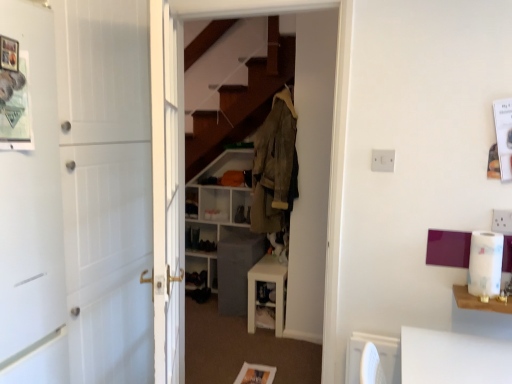
Question: Is the surface of white glossy cabinet at center in direct contact with dark gray fabric shoe at center?

Choices:
 (A) yes
 (B) no

Answer: (B)

Question: Does white glossy cabinet at center have a larger size compared to dark gray fabric shoe at center?

Choices:
 (A) no
 (B) yes

Answer: (B)

Question: Does white glossy cabinet at center have a smaller size compared to dark gray fabric shoe at center?

Choices:
 (A) yes
 (B) no

Answer: (B)

Question: Can you confirm if white glossy cabinet at center is wider than dark gray fabric shoe at center?

Choices:
 (A) no
 (B) yes

Answer: (B)

Question: Does white glossy cabinet at center have a greater height compared to dark gray fabric shoe at center?

Choices:
 (A) no
 (B) yes

Answer: (B)

Question: Is white glossy cabinet at center positioned behind dark gray fabric shoe at center?

Choices:
 (A) no
 (B) yes

Answer: (A)

Question: Can you confirm if white plastic table at right is smaller than camouflage fabric jacket at center?

Choices:
 (A) yes
 (B) no

Answer: (A)

Question: From a real-world perspective, is white plastic table at right over camouflage fabric jacket at center?

Choices:
 (A) yes
 (B) no

Answer: (B)

Question: Is white plastic table at right at the left side of camouflage fabric jacket at center?

Choices:
 (A) yes
 (B) no

Answer: (B)

Question: From the image's perspective, is white plastic table at right on top of camouflage fabric jacket at center?

Choices:
 (A) no
 (B) yes

Answer: (A)

Question: Considering the relative positions of white plastic table at right and camouflage fabric jacket at center in the image provided, is white plastic table at right behind camouflage fabric jacket at center?

Choices:
 (A) yes
 (B) no

Answer: (B)

Question: Is white plastic table at right oriented towards camouflage fabric jacket at center?

Choices:
 (A) yes
 (B) no

Answer: (B)

Question: From a real-world perspective, is white plastic shelf at center, placed as the second shelf when sorted from bottom to top, physically above wooden dresser at center?

Choices:
 (A) no
 (B) yes

Answer: (A)